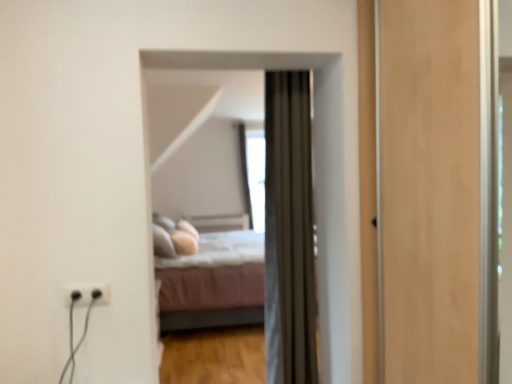
Question: Does light pink fabric bed at center have a greater height compared to velvet brown curtain at center?

Choices:
 (A) yes
 (B) no

Answer: (B)

Question: Considering the relative sizes of light pink fabric bed at center and velvet brown curtain at center in the image provided, is light pink fabric bed at center smaller than velvet brown curtain at center?

Choices:
 (A) yes
 (B) no

Answer: (B)

Question: Does light pink fabric bed at center have a lesser height compared to velvet brown curtain at center?

Choices:
 (A) no
 (B) yes

Answer: (B)

Question: Is light pink fabric bed at center further to the viewer compared to velvet brown curtain at center?

Choices:
 (A) no
 (B) yes

Answer: (B)

Question: Is velvet brown curtain at center a part of light pink fabric bed at center?

Choices:
 (A) yes
 (B) no

Answer: (B)

Question: Is light pink fabric bed at center next to velvet brown curtain at center?

Choices:
 (A) no
 (B) yes

Answer: (A)

Question: From a real-world perspective, is velvet brown curtain at center below transparent glass window at center?

Choices:
 (A) yes
 (B) no

Answer: (A)

Question: Is velvet brown curtain at center to the left of transparent glass window at center from the viewer's perspective?

Choices:
 (A) no
 (B) yes

Answer: (A)

Question: Is there a large distance between velvet brown curtain at center and transparent glass window at center?

Choices:
 (A) yes
 (B) no

Answer: (A)

Question: Is velvet brown curtain at center not within transparent glass window at center?

Choices:
 (A) yes
 (B) no

Answer: (A)

Question: Does velvet brown curtain at center have a greater height compared to transparent glass window at center?

Choices:
 (A) no
 (B) yes

Answer: (A)

Question: From a real-world perspective, does velvet brown curtain at center stand above transparent glass window at center?

Choices:
 (A) no
 (B) yes

Answer: (A)

Question: Does black plastic outlet at lower left appear on the left side of velvet brown curtain at center?

Choices:
 (A) no
 (B) yes

Answer: (B)